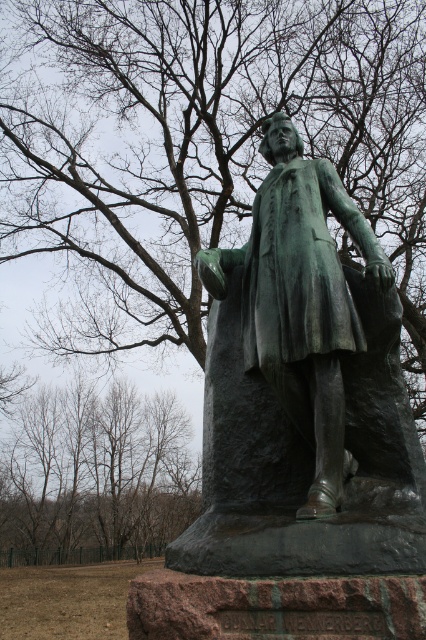
You are a photographer standing at a certain distance from the green patina statue at center. You want to take a photo where the statue fills the frame perfectly without any distortion. The recommended distance for this effect is between 10 and 12 feet. Is your current position suitable?

The distance between you and the green patina statue at center is 11.31 feet, which falls within the recommended range of 10 to 12 feet. Therefore, your current position is suitable for taking the photo without distortion.

You are a park visitor who wants to take a photo of the green patina statue at center and the brown leafless trees at lower left in the same frame. Based on their distance, do you think you can capture both in a single photo without moving your camera position?

The green patina statue at center is 32.35 meters from the brown leafless trees at lower left. Since the distance between them is significant, it might be challenging to capture both in a single frame without moving the camera. Adjusting the camera to a wider angle or moving closer might help include both subjects.

You are standing in a park and see the green patina statue at center and the brown leafless trees at lower left. Which object is higher in the image?

The green patina statue at center is above the brown leafless trees at lower left, so the statue is higher.